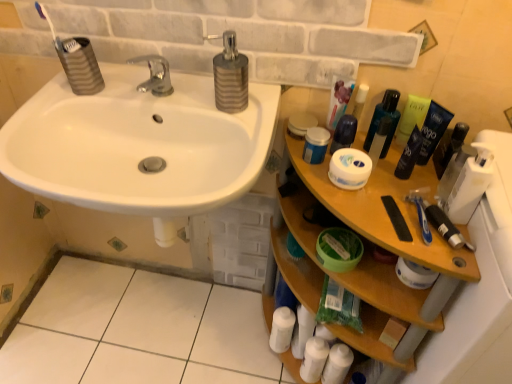
You are a GUI agent. You are given a task and a screenshot of the screen. Output one action in this format:
    pyautogui.click(x=<x>, y=<y>)
    Task: Click on the vacant space that's between blue plastic toothbrush at right, marked as the 1th toothbrush in a bottom-to-top arrangement, and white matte jar at center
    The image size is (512, 384).
    Given the screenshot: What is the action you would take?
    pyautogui.click(x=388, y=202)